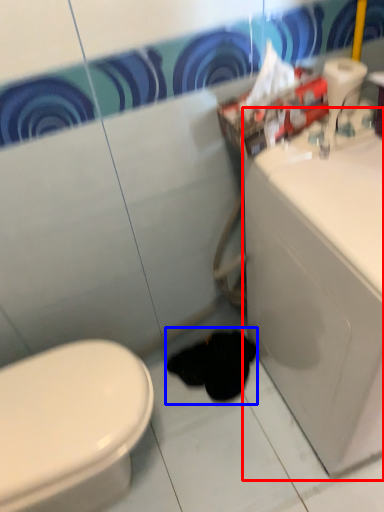
Question: Which of the following is the farthest to the observer, porcelain (highlighted by a red box) or animal (highlighted by a blue box)?

Choices:
 (A) porcelain
 (B) animal

Answer: (B)